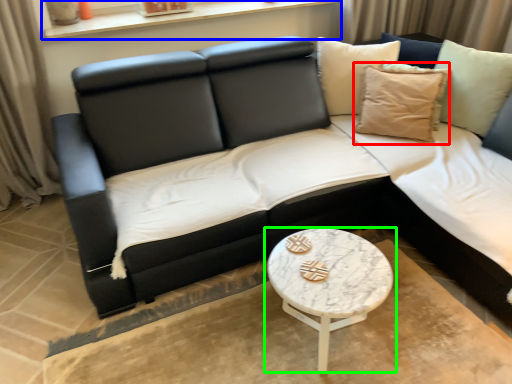
Question: Based on their relative distances, which object is nearer to pillow (highlighted by a red box)? Choose from window sill (highlighted by a blue box) and coffee table (highlighted by a green box).

Choices:
 (A) window sill
 (B) coffee table

Answer: (B)